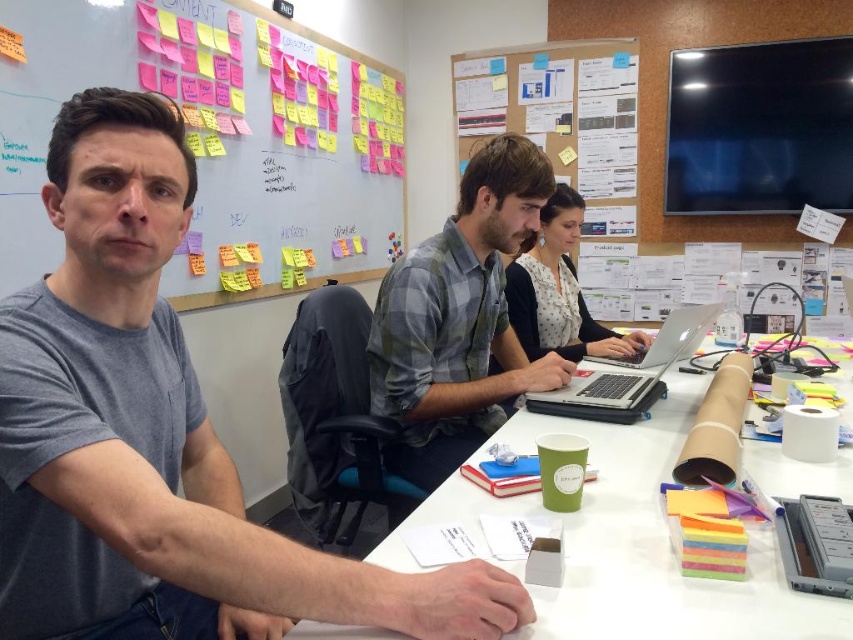
You are organizing a meeting and need to place a new folder on the table. The folder must be placed above the silver metallic laptop at center. Is there space for it above the white paper at center?

The white paper at center is located below the silver metallic laptop at center, so there is space above the white paper at center to place the folder above the silver metallic laptop at center.

You are standing in the collaborative workspace and want to move from point A to point B. Point A is at coordinate point point [49,497] and point B is at coordinate point [843,417]. Given that there is a large table in between, can you walk directly from point A to point B without going around?

Point point [49,497] is in front of point point [843,417], so the path between them is blocked by the large table in between. Therefore, you cannot walk directly from point A to point B without going around.